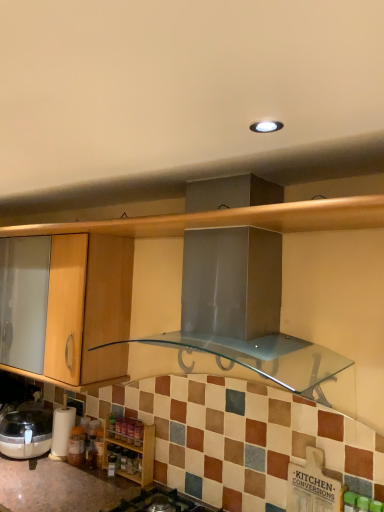
The height and width of the screenshot is (512, 384). Describe the element at coordinates (130, 448) in the screenshot. I see `wooden spice rack at lower left` at that location.

Describe the element at coordinates (162, 502) in the screenshot. I see `black glass gas stove at lower center` at that location.

Identify the location of wooden spice rack at lower left. (x=130, y=448).

Can we say wooden spice rack at lower left lies outside black glass gas stove at lower center?

Yes, wooden spice rack at lower left is outside of black glass gas stove at lower center.

Considering the sizes of wooden spice rack at lower left and black glass gas stove at lower center in the image, is wooden spice rack at lower left taller or shorter than black glass gas stove at lower center?

Considering their sizes, wooden spice rack at lower left has more height than black glass gas stove at lower center.

Can you tell me how much wooden spice rack at lower left and black glass gas stove at lower center differ in facing direction?

1.26 degrees separate the facing orientations of wooden spice rack at lower left and black glass gas stove at lower center.

Is the surface of wooden spice rack at lower left in direct contact with black glass gas stove at lower center?

wooden spice rack at lower left and black glass gas stove at lower center are not in contact.

From their relative heights in the image, would you say black glass gas stove at lower center is taller or shorter than white paper towel holder at lower left?

Clearly, black glass gas stove at lower center is shorter compared to white paper towel holder at lower left.

Between black glass gas stove at lower center and white paper towel holder at lower left, which one has smaller width?

Thinner between the two is white paper towel holder at lower left.

Can you tell me how much black glass gas stove at lower center and white paper towel holder at lower left differ in facing direction?

The angular difference between black glass gas stove at lower center and white paper towel holder at lower left is 9.15 degrees.

From a real-world perspective, who is located lower, black glass gas stove at lower center or white paper towel holder at lower left?

black glass gas stove at lower center is physically lower.

From the image's perspective, would you say black glass gas stove at lower center is shown under wooden spice rack at lower left?

Correct, black glass gas stove at lower center appears lower than wooden spice rack at lower left in the image.

Is black glass gas stove at lower center positioned with its back to wooden spice rack at lower left?

No, wooden spice rack at lower left is not at the back of black glass gas stove at lower center.

Can you confirm if black glass gas stove at lower center is thinner than wooden spice rack at lower left?

In fact, black glass gas stove at lower center might be wider than wooden spice rack at lower left.

Which is more to the right, black glass gas stove at lower center or wooden spice rack at lower left?

black glass gas stove at lower center.

Is white paper towel holder at lower left positioned with its back to black glass gas stove at lower center?

No, white paper towel holder at lower left is not facing the opposite direction of black glass gas stove at lower center.

Does white paper towel holder at lower left have a lesser height compared to black glass gas stove at lower center?

In fact, white paper towel holder at lower left may be taller than black glass gas stove at lower center.

In the image, is white paper towel holder at lower left positioned in front of or behind black glass gas stove at lower center?

Visually, white paper towel holder at lower left is located behind black glass gas stove at lower center.

Is wooden spice rack at lower left positioned with its back to white paper towel holder at lower left?

No, wooden spice rack at lower left is not facing away from white paper towel holder at lower left.

Is wooden spice rack at lower left far away from white paper towel holder at lower left?

They are positioned close to each other.

From a real-world perspective, is wooden spice rack at lower left physically located above or below white paper towel holder at lower left?

wooden spice rack at lower left is below white paper towel holder at lower left.

Considering the points (54, 440) and (120, 438), which point is in front, point (54, 440) or point (120, 438)?

The point (120, 438) is more forward.

Looking at the image, does white paper towel holder at lower left seem bigger or smaller compared to wooden spice rack at lower left?

Clearly, white paper towel holder at lower left is smaller in size than wooden spice rack at lower left.

Considering the relative positions of white paper towel holder at lower left and wooden spice rack at lower left in the image provided, is white paper towel holder at lower left to the left of wooden spice rack at lower left from the viewer's perspective?

Correct, you'll find white paper towel holder at lower left to the left of wooden spice rack at lower left.

At what (x,y) coordinates should I click in order to perform the action: click on cabinetry above the black glass gas stove at lower center (from a real-world perspective). Please return your answer as a coordinate pair (x, y). This screenshot has height=512, width=384. Looking at the image, I should click on (130, 448).

Locate an element on the screen. This screenshot has height=512, width=384. appliance that is behind the black glass gas stove at lower center is located at coordinates (62, 430).

Estimate the real-world distances between objects in this image. Which object is closer to white paper towel holder at lower left, black glass gas stove at lower center or wooden spice rack at lower left?

The object closer to white paper towel holder at lower left is wooden spice rack at lower left.

Based on their spatial positions, is black glass gas stove at lower center or white paper towel holder at lower left closer to wooden spice rack at lower left?

Among the two, black glass gas stove at lower center is located nearer to wooden spice rack at lower left.

Based on the photo, looking at the image, which one is located closer to black glass gas stove at lower center, white paper towel holder at lower left or wooden spice rack at lower left?

wooden spice rack at lower left is positioned closer to the anchor black glass gas stove at lower center.

Which object lies further to the anchor point black glass gas stove at lower center, wooden spice rack at lower left or white paper towel holder at lower left?

white paper towel holder at lower left is positioned further to the anchor black glass gas stove at lower center.

Estimate the real-world distances between objects in this image. Which object is closer to white paper towel holder at lower left, wooden spice rack at lower left or black glass gas stove at lower center?

Among the two, wooden spice rack at lower left is located nearer to white paper towel holder at lower left.

Based on their spatial positions, is white paper towel holder at lower left or black glass gas stove at lower center closer to wooden spice rack at lower left?

The object closer to wooden spice rack at lower left is black glass gas stove at lower center.

Where is `cabinetry located between black glass gas stove at lower center and white paper towel holder at lower left in the depth direction`? The image size is (384, 512). cabinetry located between black glass gas stove at lower center and white paper towel holder at lower left in the depth direction is located at coordinates (130, 448).